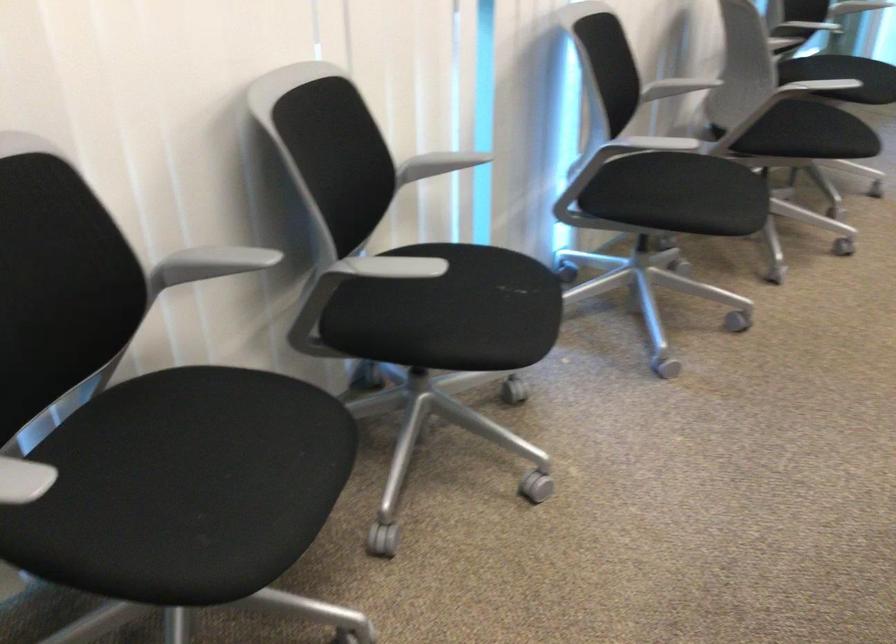
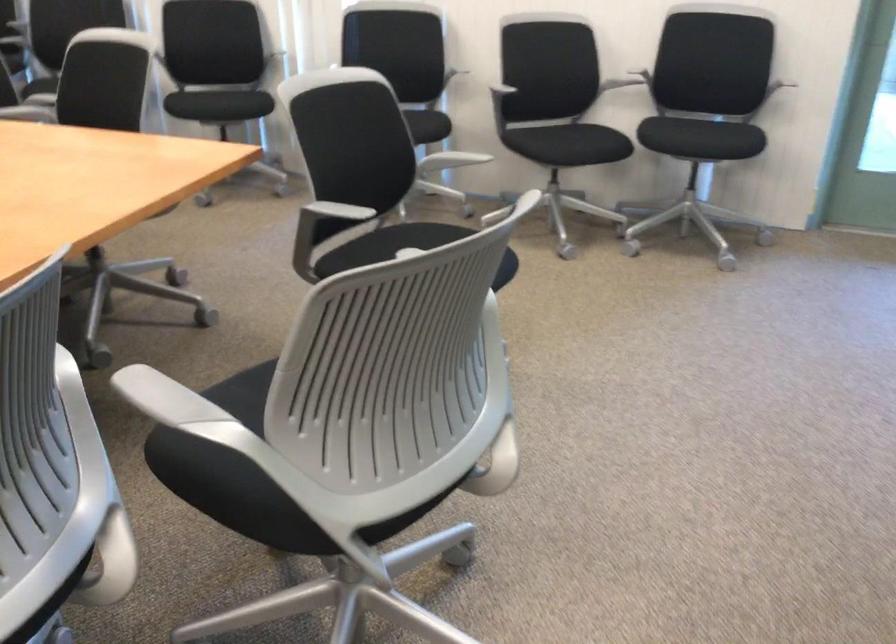
In the second image, find the point that corresponds to (480,292) in the first image.

(238, 102)